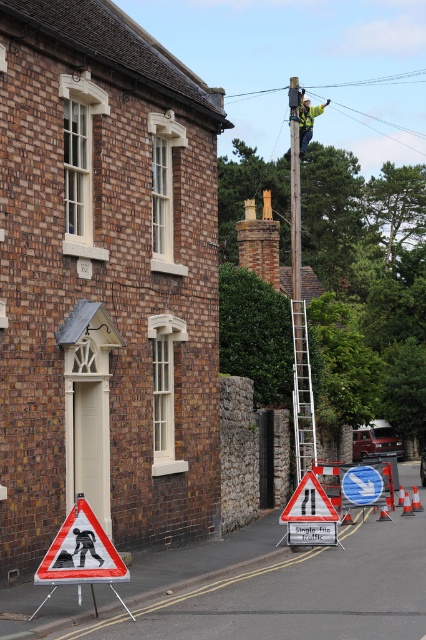
Question: Among these points, which one is nearest to the camera?

Choices:
 (A) (348, 492)
 (B) (298, 300)
 (C) (109, 572)
 (D) (328, 104)

Answer: (C)

Question: Can you confirm if silver metallic ladder at center is thinner than yellow reflective safety vest at upper center?

Choices:
 (A) no
 (B) yes

Answer: (B)

Question: Among these points, which one is farthest from the camera?

Choices:
 (A) (308, 116)
 (B) (311, 387)
 (C) (40, 572)
 (D) (365, 493)

Answer: (A)

Question: Can you confirm if reflective plastic pedestrian crossing sign at lower left is smaller than yellow reflective safety vest at upper center?

Choices:
 (A) no
 (B) yes

Answer: (B)

Question: Is white plastic pedestrian crossing sign at lower left wider than yellow reflective safety vest at upper center?

Choices:
 (A) no
 (B) yes

Answer: (A)

Question: Which is farther from the white plastic pedestrian crossing sign at lower left?

Choices:
 (A) silver metallic ladder at center
 (B) reflective plastic pedestrian crossing sign at lower left

Answer: (B)